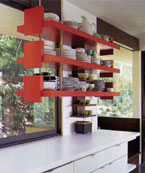
You are a GUI agent. You are given a task and a screenshot of the screen. Output one action in this format:
    pyautogui.click(x=<x>, y=<y>)
    Task: Click on the white pitcher
    
    Given the screenshot: What is the action you would take?
    pyautogui.click(x=86, y=27)